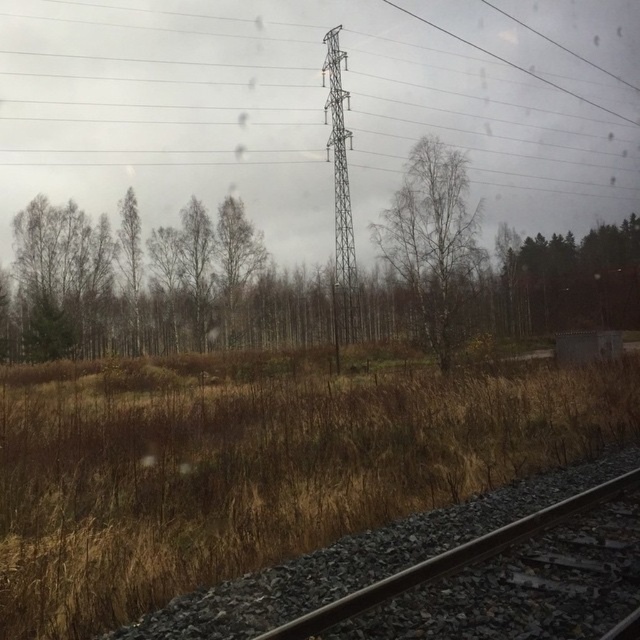
Does brown leafy trees at center have a lesser width compared to green leafy tree at right?

No, brown leafy trees at center is not thinner than green leafy tree at right.

Can you confirm if brown leafy trees at center is positioned to the right of green leafy tree at right?

Incorrect, brown leafy trees at center is not on the right side of green leafy tree at right.

Does point (440, 232) lie behind point (541, 260)?

No.

Image resolution: width=640 pixels, height=640 pixels. Find the location of `brown leafy trees at center`. brown leafy trees at center is located at coordinates (312, 285).

Is metallic tower at upper center taller than brown leafy trees at center?

Correct, metallic tower at upper center is much taller as brown leafy trees at center.

Does metallic tower at upper center come behind brown leafy trees at center?

Yes, metallic tower at upper center is behind brown leafy trees at center.

Between point (8, 92) and point (476, 304), which one is positioned behind?

Positioned behind is point (8, 92).

You are a GUI agent. You are given a task and a screenshot of the screen. Output one action in this format:
    pyautogui.click(x=<x>, y=<y>)
    Task: Click on the metallic tower at upper center
    This screenshot has height=640, width=640.
    Given the screenshot: What is the action you would take?
    pyautogui.click(x=296, y=90)

Looking at this image, which of these two, brown dry grass at lower left or green leafy tree at right, stands taller?

green leafy tree at right is taller.

Who is more distant from viewer, (88,522) or (524,243)?

The point (524,243) is behind.

In order to click on brown dry grass at lower left in this screenshot , I will do `click(257, 472)`.